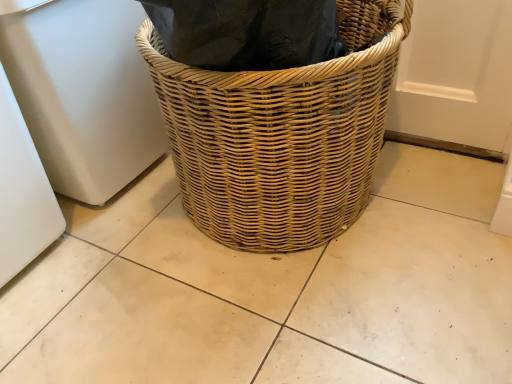
The width and height of the screenshot is (512, 384). I want to click on unoccupied area in front of natural woven basket at center, so click(x=315, y=328).